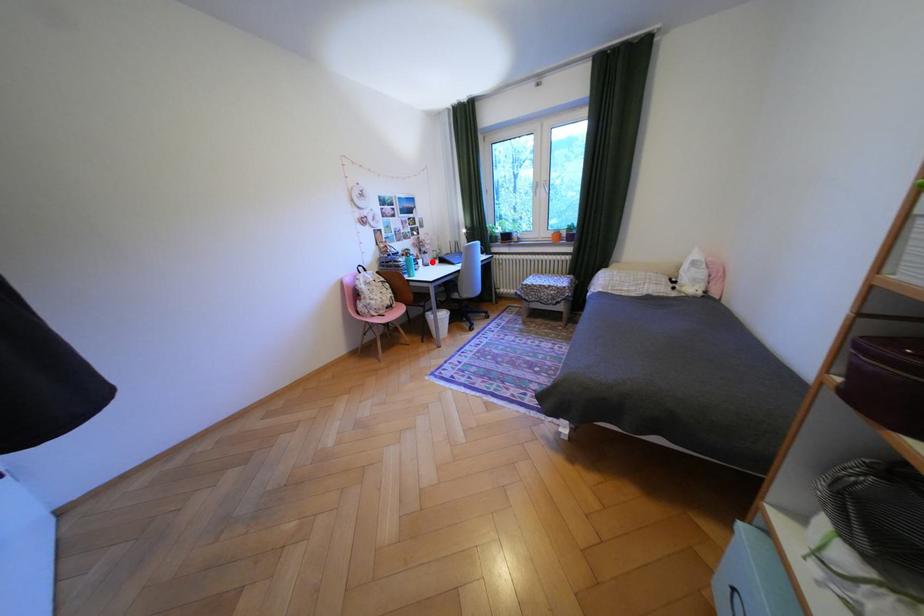
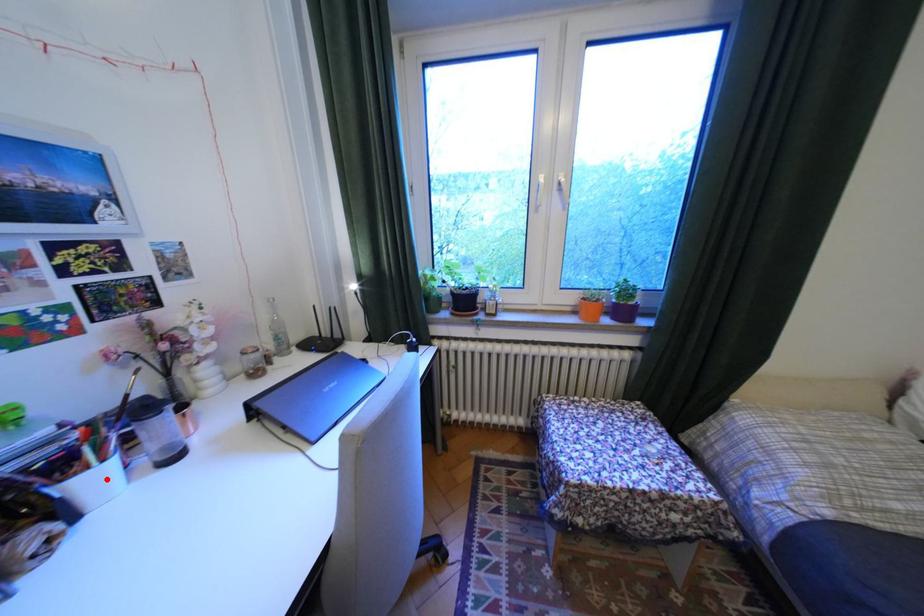
I am providing you with two images of the same scene from different viewpoints. A red point is marked on the first image and another point is marked on the second image. Is the marked point in image1 the same physical position as the marked point in image2?

Yes